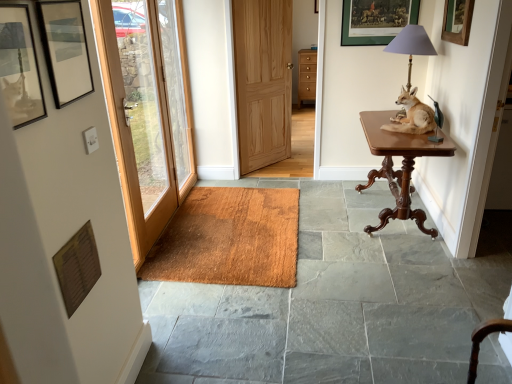
Find the location of a particular element. The height and width of the screenshot is (384, 512). vacant region in front of mahogany wood table at right is located at coordinates (395, 272).